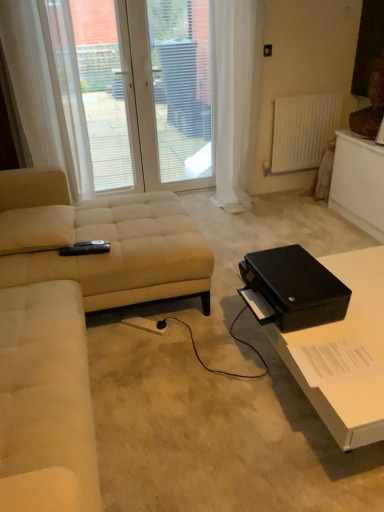
Identify the location of free point in front of white fabric curtain at right, the first curtain viewed from the right. (260, 220).